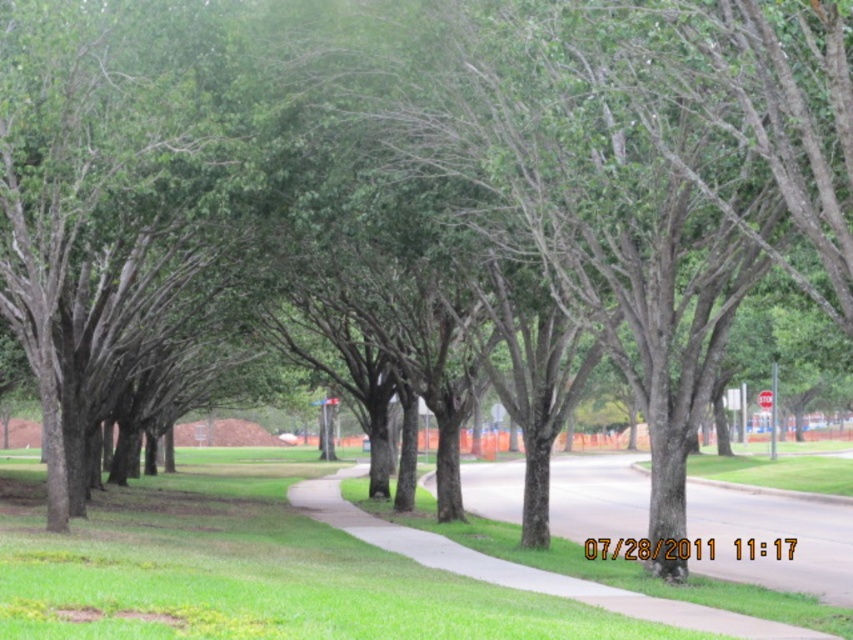
Question: Which object appears farthest from the camera in this image?

Choices:
 (A) green grass at center
 (B) gray asphalt pavement at center

Answer: (B)

Question: Which point is closer to the camera?

Choices:
 (A) (506, 481)
 (B) (293, 524)

Answer: (B)

Question: Does green grass at center appear over gray asphalt pavement at center?

Choices:
 (A) no
 (B) yes

Answer: (B)

Question: Is green grass at center positioned at the back of gray asphalt pavement at center?

Choices:
 (A) no
 (B) yes

Answer: (A)

Question: Can you confirm if green grass at center is wider than gray asphalt pavement at center?

Choices:
 (A) yes
 (B) no

Answer: (A)